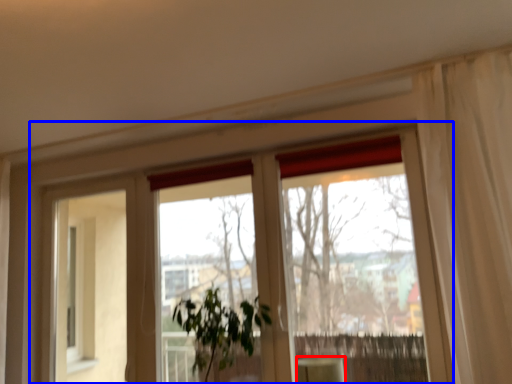
Question: Which of the following is the farthest to the observer, furniture (highlighted by a red box) or window (highlighted by a blue box)?

Choices:
 (A) furniture
 (B) window

Answer: (B)